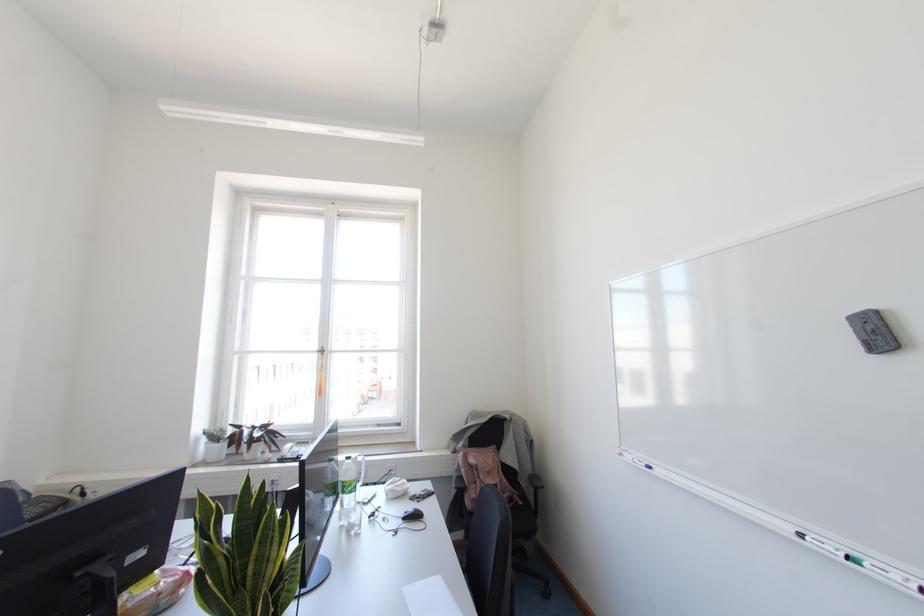
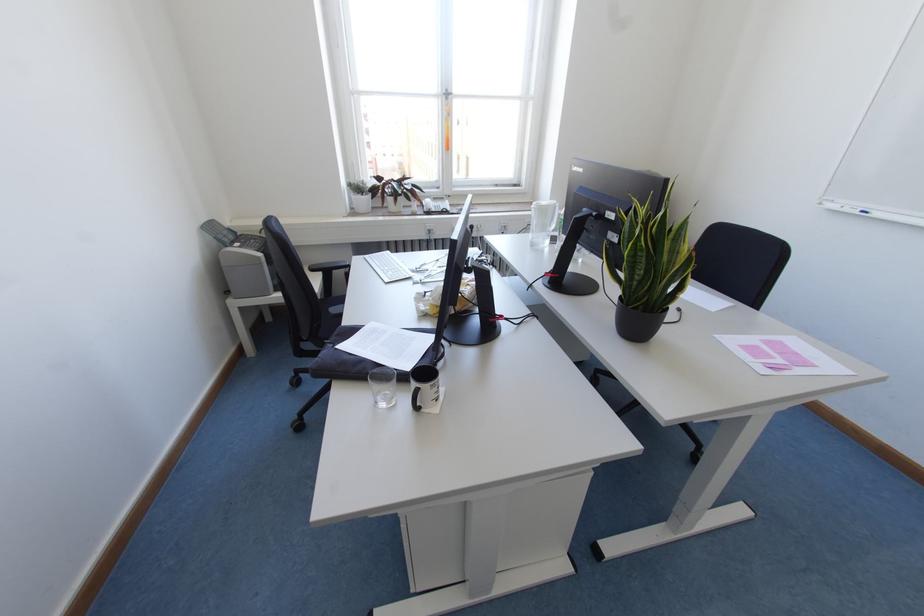
The point at (649, 467) is marked in the first image. Where is the corresponding point in the second image?

(864, 213)